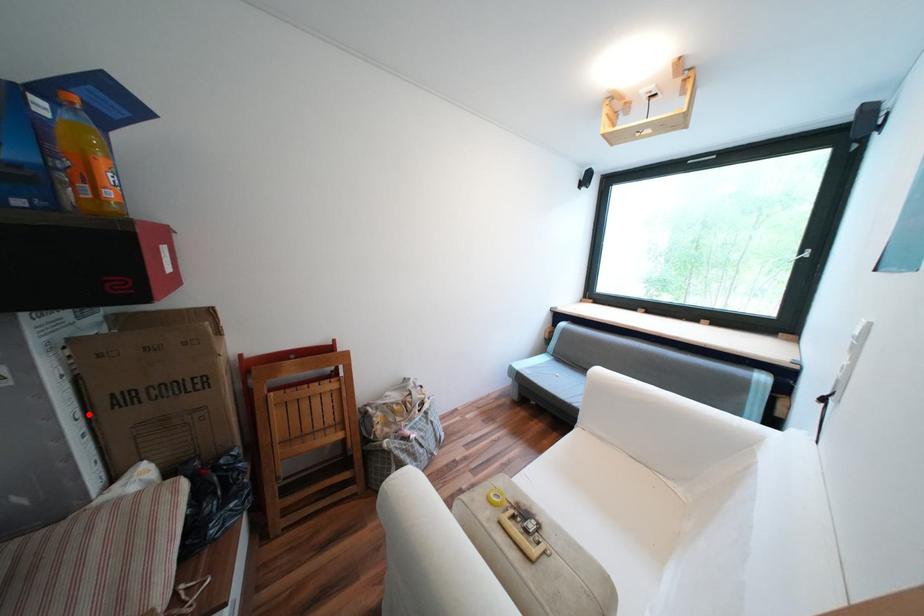
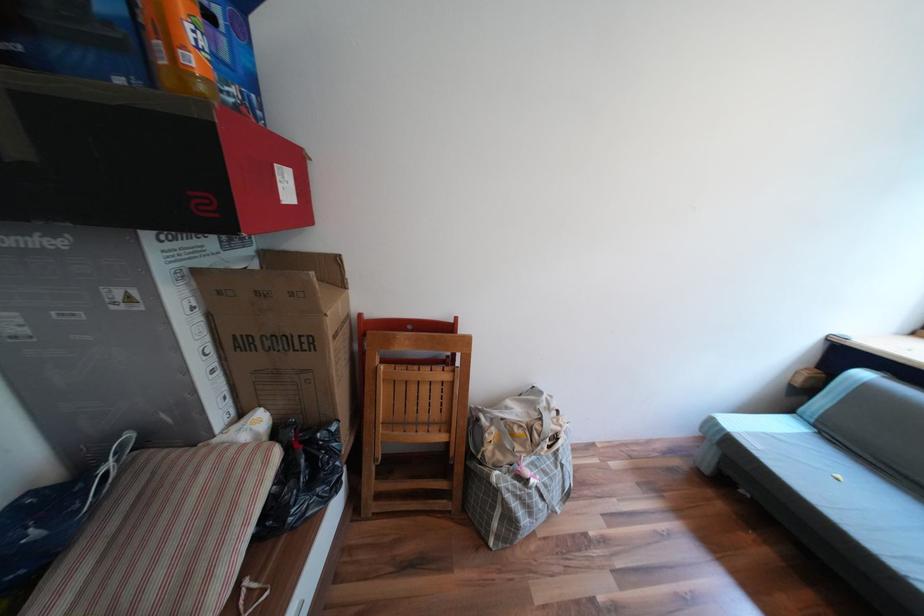
Where in the second image is the point corresponding to the highlighted location from the first image?

(219, 349)